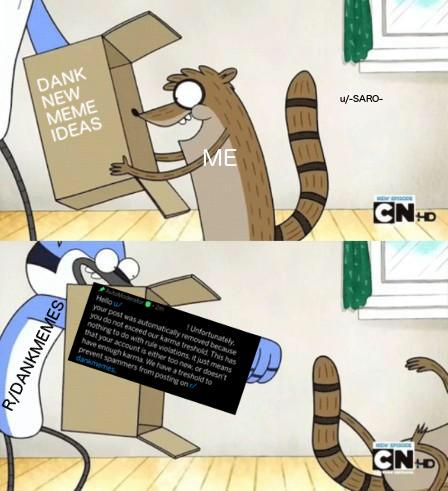
At what (x,y) coordinates should I click in order to perform the action: click on window sill. Please return your answer as a coordinate pair (x, y). The width and height of the screenshot is (448, 491). Looking at the image, I should click on (429, 301), (425, 60).